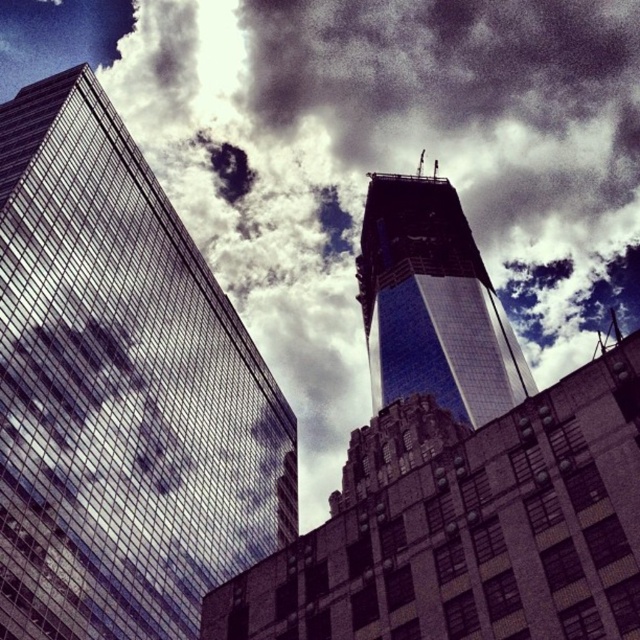
You are a drone operator planning to fly a drone from the reflective glass skyscraper at left to the blue glass skyscraper at center. According to the scene, which direction should you fly the drone to reach the destination?

The reflective glass skyscraper at left is to the left of the blue glass skyscraper at center, so you should fly the drone to the right to reach the destination.

You are an architect analyzing the urban layout. Given the scene, which of the two skyscrapers, the reflective glass skyscraper at left or the blue glass skyscraper at center, has a greater horizontal span when viewed from above?

The reflective glass skyscraper at left has a greater horizontal span than the blue glass skyscraper at center because its width is larger, as stated in the description.

Consider the image. You are a drone operator trying to navigate between two skyscrapers in the city. You have a drone that can only fly up to 0.5 units high. The reflective glass skyscraper at left is represented by point (120, 390). Can your drone safely pass between them without hitting the reflective glass skyscraper at left?

The reflective glass skyscraper at left is represented by point (120, 390). Since the drone can only fly up to 0.5 units high, and the point (120, 390) has a y coordinate of 0.189 which is below 0.5, the drone can safely pass under the reflective glass skyscraper at left.